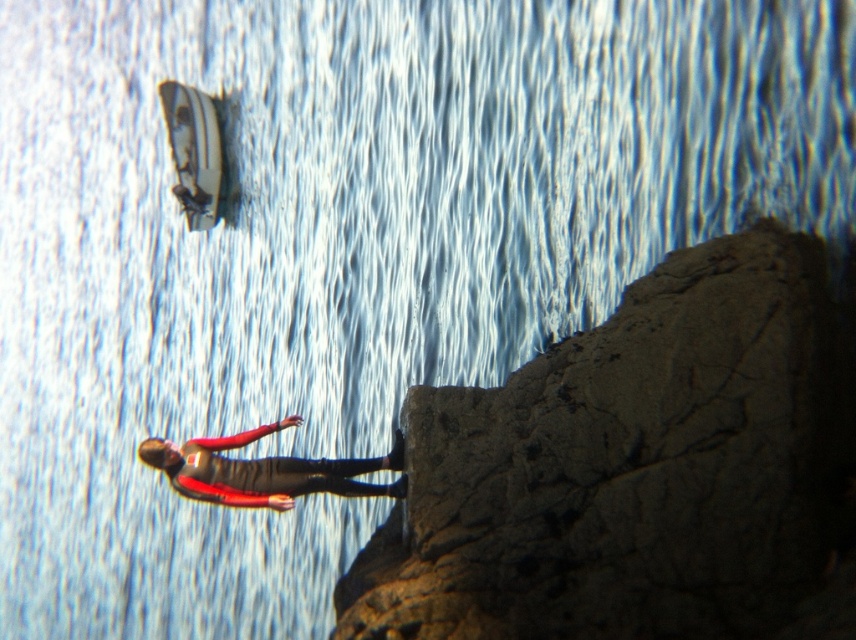
Is rough stone cliff at center further to the viewer compared to red fabric jacket at center?

That is False.

Which is behind, point (599, 362) or point (251, 480)?

Point (251, 480)

The width and height of the screenshot is (856, 640). Identify the location of rough stone cliff at center. (639, 470).